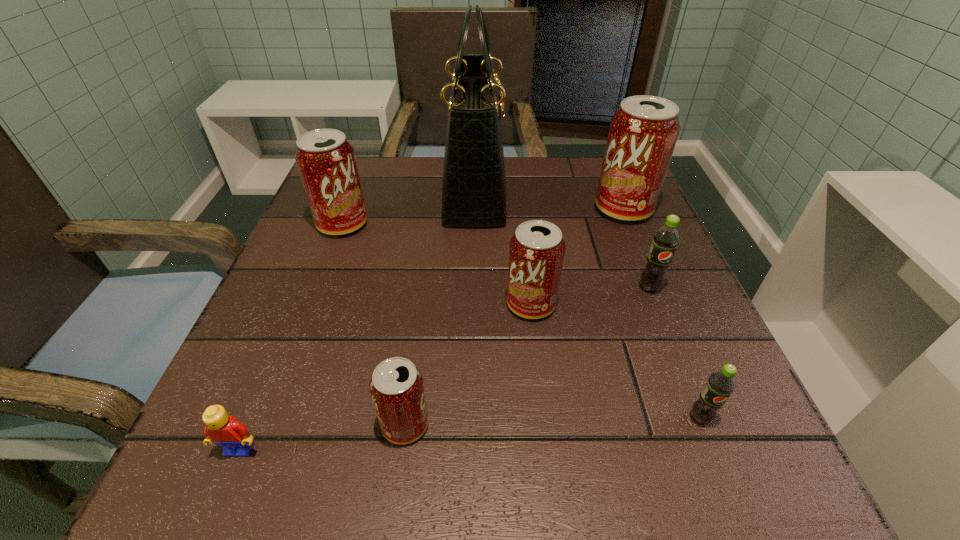
Image resolution: width=960 pixels, height=540 pixels. Find the location of `handbag`. handbag is located at coordinates (474, 184).

This screenshot has width=960, height=540. I want to click on the tallest soda, so click(x=643, y=133).

In order to click on the rightmost red soda can in this screenshot , I will do `click(643, 133)`.

What are the coordinates of `the second biggest red soda can` in the screenshot? It's located at (326, 161).

Where is `the leftmost soda`? This screenshot has width=960, height=540. the leftmost soda is located at coordinates (326, 161).

Image resolution: width=960 pixels, height=540 pixels. What are the coordinates of `the second red soda can from right to left` in the screenshot? It's located at (536, 253).

Where is `the second smallest red soda can`? This screenshot has width=960, height=540. the second smallest red soda can is located at coordinates (536, 253).

Locate an element on the screen. the bigger green soda is located at coordinates (666, 239).

I want to click on the third red soda can from right to left, so click(x=397, y=390).

Find the location of a particular element. The height and width of the screenshot is (540, 960). the smallest red soda can is located at coordinates (397, 390).